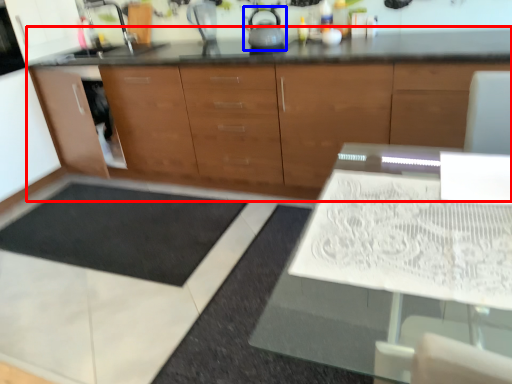
Question: Which object is further to the camera taking this photo, cabinetry (highlighted by a red box) or tea pot (highlighted by a blue box)?

Choices:
 (A) cabinetry
 (B) tea pot

Answer: (B)